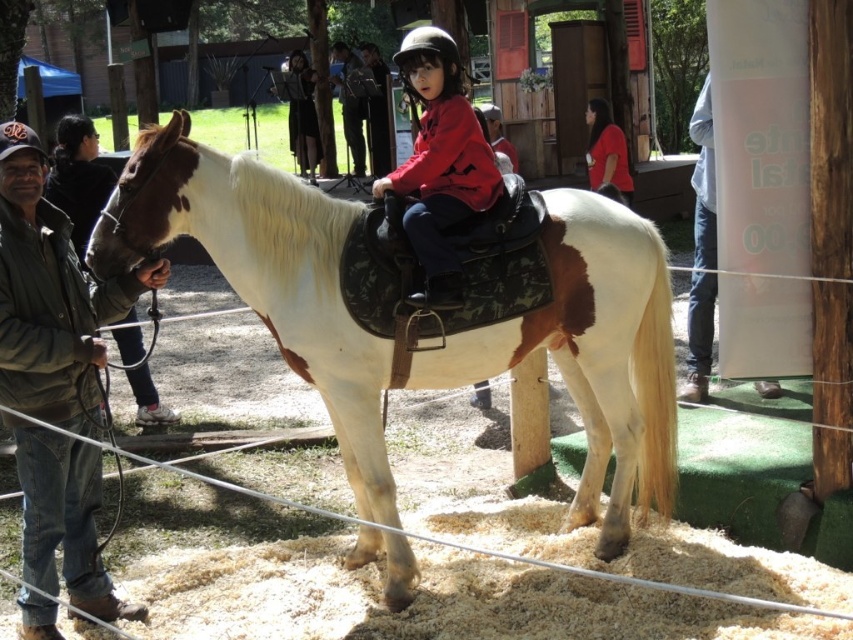
Question: Which object is positioned farthest from the blue jeans at right?

Choices:
 (A) red matte shirt at center
 (B) white leather horse at center

Answer: (A)

Question: Which is farther from the blue jeans at right?

Choices:
 (A) green matte jacket at left
 (B) white leather horse at center
 (C) brown leather jacket at left
 (D) red matte shirt at center

Answer: (A)

Question: Which of the following is the closest to the observer?

Choices:
 (A) white leather horse at center
 (B) brown leather jacket at left
 (C) blue jeans at right
 (D) green matte jacket at left

Answer: (B)

Question: Is white leather horse at center to the left of red matte shirt at center from the viewer's perspective?

Choices:
 (A) no
 (B) yes

Answer: (B)

Question: Is brown leather jacket at left positioned in front of blue jeans at right?

Choices:
 (A) yes
 (B) no

Answer: (A)

Question: Is red matte shirt at center to the right of blue jeans at right from the viewer's perspective?

Choices:
 (A) no
 (B) yes

Answer: (A)